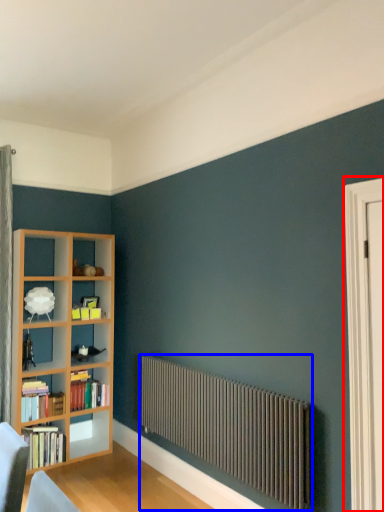
Question: Among these objects, which one is farthest to the camera, screen door (highlighted by a red box) or radiator (highlighted by a blue box)?

Choices:
 (A) screen door
 (B) radiator

Answer: (B)